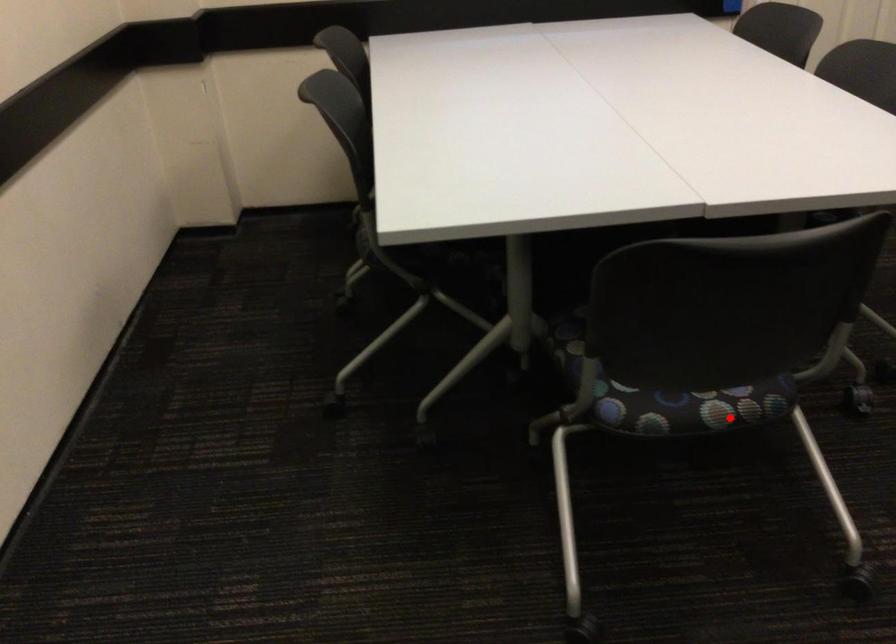
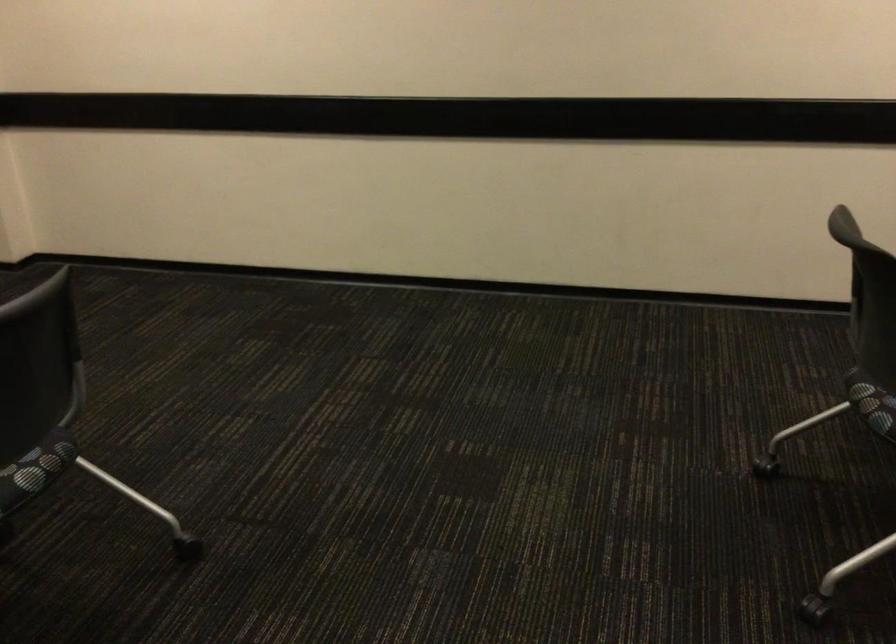
Question: I am providing you with two images of the same scene from different viewpoints. Given a red point in image1, look at the same physical point in image2. Is it:

Choices:
 (A) Closer to the viewpoint
 (B) Farther from the viewpoint

Answer: (B)